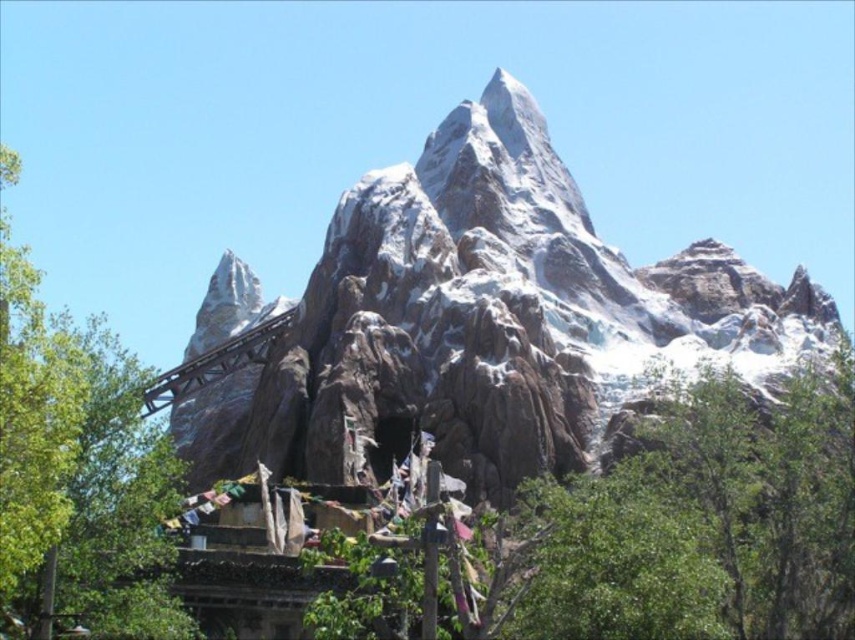
You are standing at the base of the artificial mountain and want to take a photo of both the green leafy tree at center and the green leafy tree at left. Which tree should you position closer to the front of the photo to include both in the frame?

You should position the green leafy tree at center closer to the front of the photo because it is positioned under the green leafy tree at left, meaning the tree at left is further back. This way, both trees will be visible in the frame.

You are standing in front of the artificial mountain and see two green leafy trees. Which tree, the green leafy tree at center or the green leafy tree at left, is located to the right of the other?

The green leafy tree at center is positioned on the right side of the green leafy tree at left.

Based on the photo, you are standing in front of the artificial mountain and want to walk towards the green leafy tree at center and the green leafy tree at left. Which tree will you reach first?

You will reach the green leafy tree at center first because it is closer to you than the green leafy tree at left, which is further away.